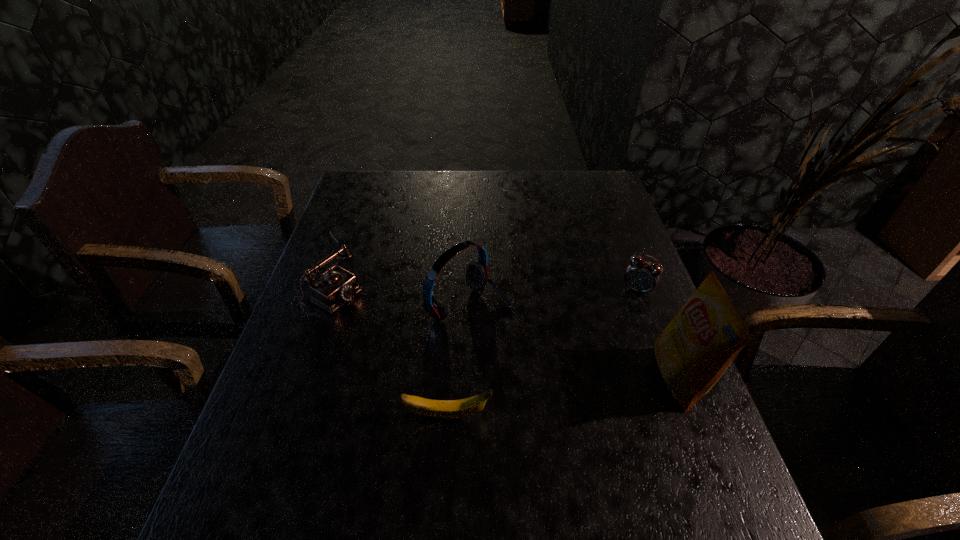
Where is `the shortest object`? The image size is (960, 540). the shortest object is located at coordinates (447, 409).

Where is `the tallest object`? The width and height of the screenshot is (960, 540). the tallest object is located at coordinates (695, 349).

The image size is (960, 540). In order to click on the second tallest object in this screenshot , I will do coord(477,275).

Locate an element on the screen. The width and height of the screenshot is (960, 540). alarm clock is located at coordinates (642, 276).

Where is `telephone`? telephone is located at coordinates (338, 286).

The image size is (960, 540). I want to click on vacant region located 0.190m at the stem of the banana, so click(585, 416).

Find the location of `free region located on the front-facing side of the tallest object`. free region located on the front-facing side of the tallest object is located at coordinates (501, 377).

The height and width of the screenshot is (540, 960). I want to click on free location located on the front-facing side of the tallest object, so point(474,377).

Locate an element on the screen. The height and width of the screenshot is (540, 960). vacant area situated on the front-facing side of the tallest object is located at coordinates (483, 377).

This screenshot has width=960, height=540. Find the location of `vacant space located with the microphone attached to the side of the headset`. vacant space located with the microphone attached to the side of the headset is located at coordinates (562, 360).